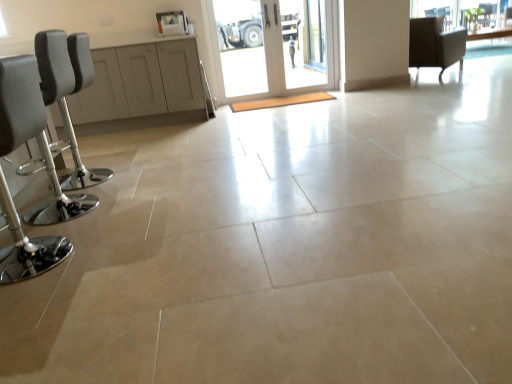
Question: From a real-world perspective, relative to transparent glass door at center, is metallic chrome barstool at left, which is the 3th chair in back-to-front order, vertically above or below?

Choices:
 (A) below
 (B) above

Answer: (A)

Question: Is metallic chrome barstool at left, which is the 3th chair in back-to-front order, inside the boundaries of transparent glass door at center, or outside?

Choices:
 (A) outside
 (B) inside

Answer: (A)

Question: Considering the real-world distances, which object is farthest from the white glossy door at center?

Choices:
 (A) clear glass window at upper right
 (B) metallic chrome barstool at left, the first chair when ordered from front to back
 (C) dark gray fabric chair at upper right, placed as the 1th chair when sorted from right to left
 (D) clear glass window screen at upper right
 (E) transparent glass door at center

Answer: (D)

Question: Which of these objects is positioned farthest from the matte gray cabinet at left?

Choices:
 (A) black leather barstool at left, the second chair ordered from the bottom
 (B) clear glass window at upper right
 (C) white glossy door at center
 (D) clear glass window screen at upper right
 (E) dark gray fabric chair at upper right, placed as the 1th chair when sorted from right to left

Answer: (D)